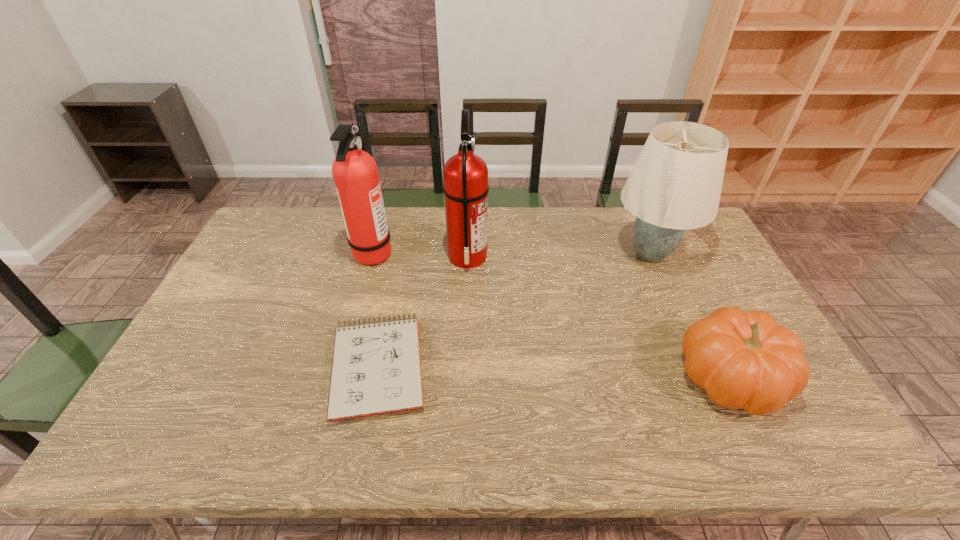
You are a GUI agent. You are given a task and a screenshot of the screen. Output one action in this format:
    pyautogui.click(x=<x>, y=<y>)
    Task: Click on the vacant space that satisfies the following two spatial constraints: 1. at the nozzle of the fourth tallest object; 2. on the left side of the right fire extinguisher
    This screenshot has height=540, width=960.
    Given the screenshot: What is the action you would take?
    pyautogui.click(x=464, y=377)

Where is `vacant space that satisfies the following two spatial constraints: 1. on the handle side of the left fire extinguisher; 2. on the left side of the lampshade`? Image resolution: width=960 pixels, height=540 pixels. vacant space that satisfies the following two spatial constraints: 1. on the handle side of the left fire extinguisher; 2. on the left side of the lampshade is located at coordinates (372, 254).